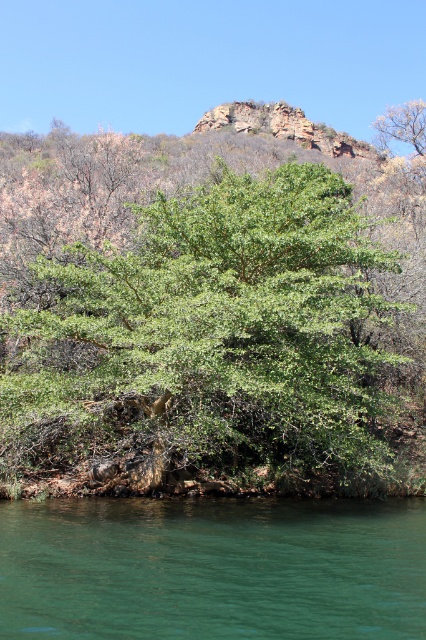
From the picture: You are standing in the landscape and want to walk from the green leafy tree at center to the green smooth water at lower center. Which direction should you move relative to the tree?

You should move towards the lower center direction relative to the green leafy tree at center to reach the green smooth water at lower center, as the water is positioned below the tree in the scene.

Consider the image. You are a hiker who wants to take a photo of the green leafy tree at center and the green smooth water at lower center. Which object should you focus on first if you want to capture both in a single frame without moving your camera?

The green leafy tree at center is larger in size compared to the green smooth water at lower center, so you should focus on the green leafy tree at center first to ensure it fills the frame appropriately before adjusting for the smaller water area.